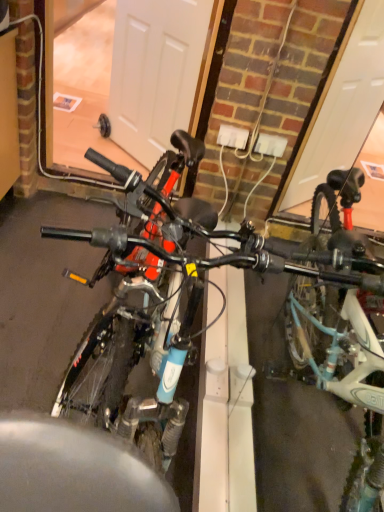
Question: Considering the positions of blue matte bicycle at center, the second bicycle viewed from the right, and white matte door at center in the image, is blue matte bicycle at center, the second bicycle viewed from the right, wider or thinner than white matte door at center?

Choices:
 (A) wide
 (B) thin

Answer: (A)

Question: From a real-world perspective, is blue matte bicycle at center, the second bicycle viewed from the right, physically located above or below white matte door at center?

Choices:
 (A) above
 (B) below

Answer: (A)

Question: Which object is the closest to the teal matte bicycle at right, which ranks as the 1th bicycle in right-to-left order?

Choices:
 (A) white matte door at center
 (B) blue matte bicycle at center, which is the 1th bicycle in left-to-right order

Answer: (B)

Question: Which of these objects is positioned farthest from the white matte door at center?

Choices:
 (A) teal matte bicycle at right, placed as the second bicycle when sorted from left to right
 (B) blue matte bicycle at center, which is the 1th bicycle in left-to-right order

Answer: (B)